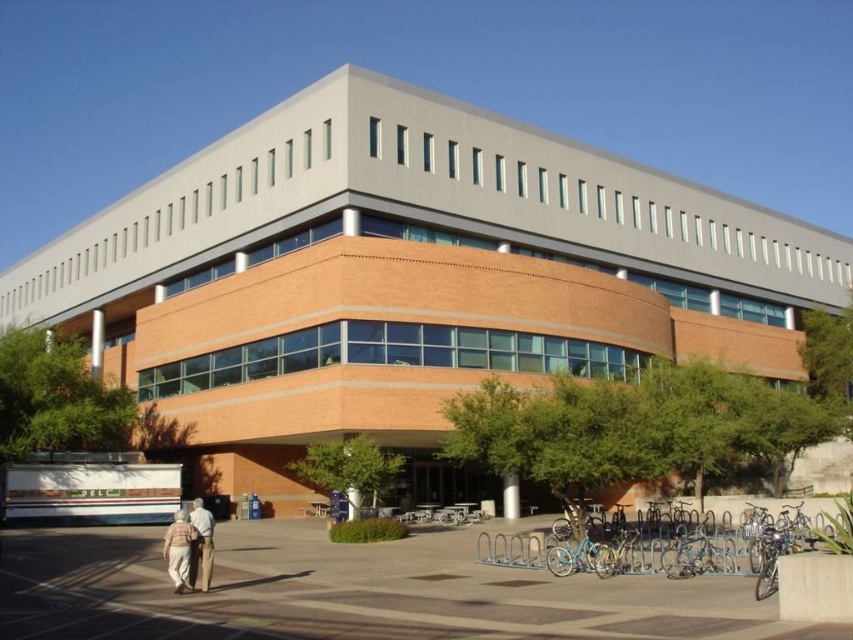
You are standing in front of the brick building at center and want to park your bicycle. Based on the scene, can you determine if the blue metallic bicycle at lower right is positioned in a suitable area for parking?

The brick building at center is located above the blue metallic bicycle at lower right, which means the bicycle is parked in the lower area near the ground level. Since the scene mentions a bicycle rack filled with bicycles in the foreground, the blue metallic bicycle at lower right is likely positioned in a suitable parking area.

You are standing in front of the modern building and notice a blue metallic bicycle at lower right and a light brown pants at lower left. Which object is taller?

The light brown pants at lower left is taller than the blue metallic bicycle at lower right.